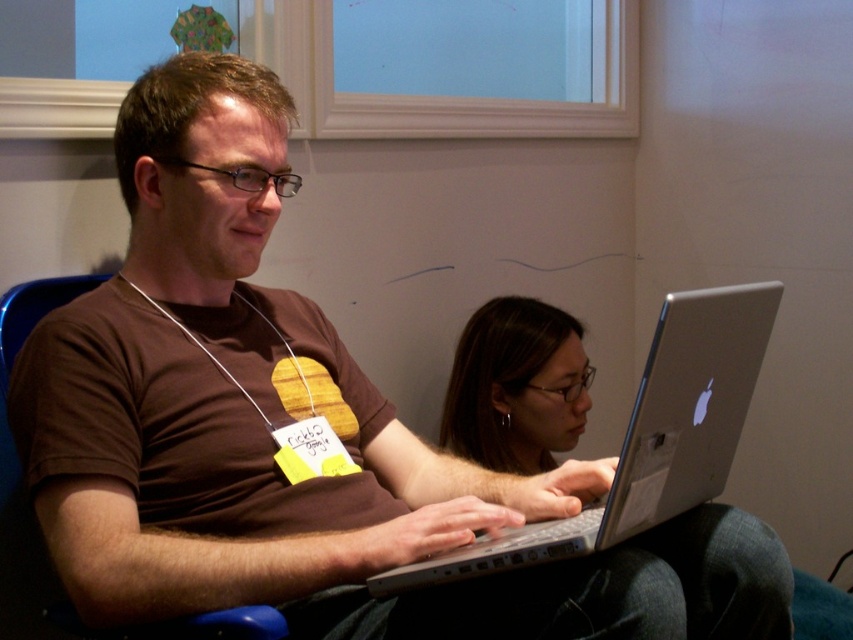
Question: Is silver metallic laptop at center bigger than matte black hair at center?

Choices:
 (A) yes
 (B) no

Answer: (A)

Question: Which point is farther to the camera?

Choices:
 (A) (550, 355)
 (B) (421, 564)
 (C) (38, 291)

Answer: (A)

Question: Among these points, which one is nearest to the camera?

Choices:
 (A) (236, 627)
 (B) (622, 529)

Answer: (A)

Question: Is matte black hair at center above blue plastic chair at left?

Choices:
 (A) yes
 (B) no

Answer: (B)

Question: Which object is positioned farthest from the silver metallic laptop at center?

Choices:
 (A) matte black hair at center
 (B) blue plastic chair at left

Answer: (B)

Question: Does matte black hair at center have a larger size compared to blue plastic chair at left?

Choices:
 (A) no
 (B) yes

Answer: (B)